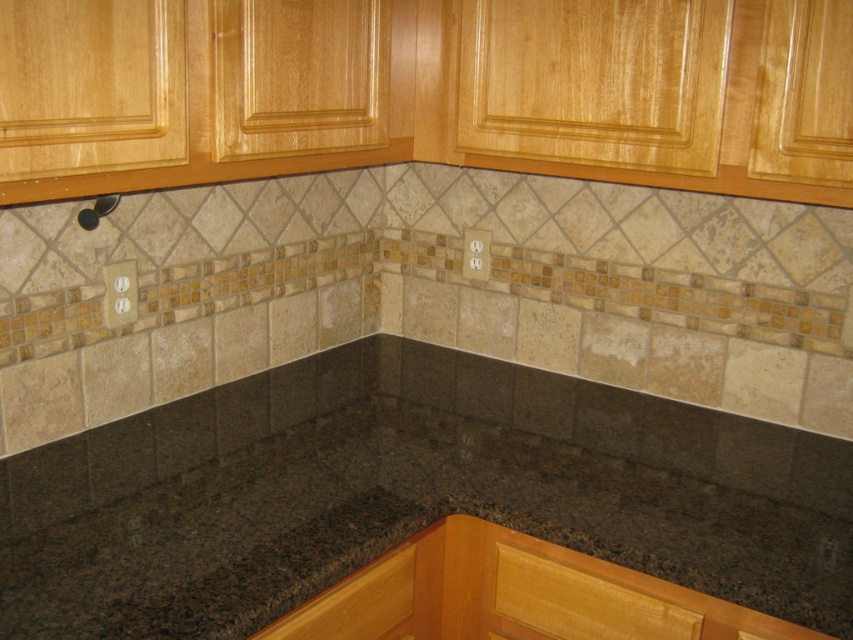
You are a chef preparing to place a large cutting board on the black granite countertop at center. The wooden drawer at lower center contains your knives. Can you safely place the board on the countertop without it hanging over the edge near the drawer?

The black granite countertop at center and wooden drawer at lower center are 32.24 centimeters apart. Since the distance is sufficient, the cutting board can be placed on the countertop without overhanging near the drawer.

You are a kitchen designer planning to install a new faucet. The faucet requires a 10 cm diameter circular space on the black granite countertop at center. Can you confirm if the space at point (407, 493) is suitable for placing the faucet?

The black granite countertop at center is located at point (407, 493). Since the faucet requires a 10 cm diameter circular space, it depends on whether there is enough clearance around that point to accommodate the faucet without obstruction. However, the provided information does not specify the available space around the point, so we cannot confirm suitability based on the given data.

You are organizing a kitchen and need to place a spice jar on the counter near the light wood drawer at lower right. Where should you place the spice jar relative to the black granite countertop at center?

The black granite countertop at center is to the left of the light wood drawer at lower right, so you should place the spice jar to the right of the black granite countertop at center to position it near the light wood drawer at lower right.